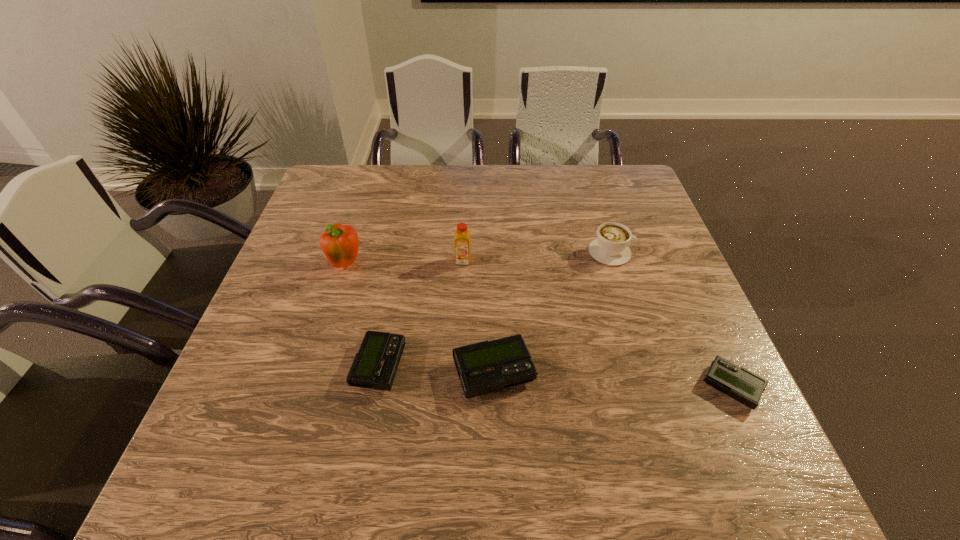
Image resolution: width=960 pixels, height=540 pixels. Identify the location of object present at the near right corner. (736, 382).

Find the location of a particular element. The width and height of the screenshot is (960, 540). vacant space at the far edge of the desktop is located at coordinates click(492, 208).

You are a GUI agent. You are given a task and a screenshot of the screen. Output one action in this format:
    pyautogui.click(x=<x>, y=<y>)
    Task: Click on the vacant area at the near edge
    
    Given the screenshot: What is the action you would take?
    pyautogui.click(x=401, y=417)

The height and width of the screenshot is (540, 960). I want to click on vacant space at the left edge, so click(x=318, y=250).

At what (x,y) coordinates should I click in order to perform the action: click on vacant space at the right edge. Please return your answer as a coordinate pair (x, y). The height and width of the screenshot is (540, 960). Looking at the image, I should click on click(697, 307).

Where is `vacant area at the far right corner`? This screenshot has width=960, height=540. vacant area at the far right corner is located at coordinates (611, 165).

Where is `vacant area between the orange juice and the fourth tallest object`? The height and width of the screenshot is (540, 960). vacant area between the orange juice and the fourth tallest object is located at coordinates (478, 317).

Identify the location of empty space that is in between the second beeper from right to left and the leftmost beeper. (437, 369).

Find the location of a particular element. free space that is in between the second beeper from left to right and the rightmost object is located at coordinates (612, 380).

Locate an element on the screen. unoccupied position between the second tallest beeper and the fifth shortest object is located at coordinates (421, 313).